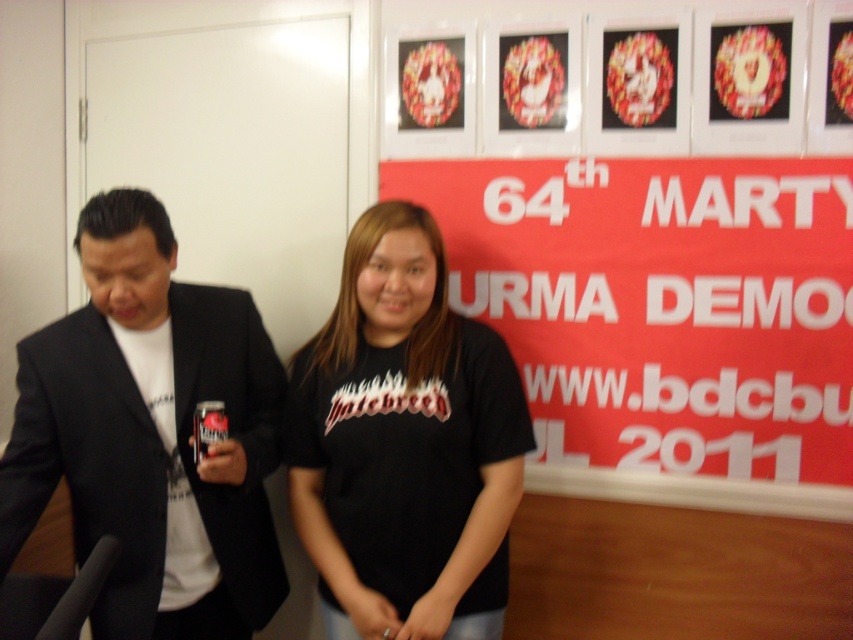
Can you confirm if black matte suit at left is wider than black matte t-shirt at center?

Incorrect, black matte suit at left's width does not surpass black matte t-shirt at center's.

I want to click on black matte suit at left, so click(151, 435).

The height and width of the screenshot is (640, 853). Describe the element at coordinates (151, 435) in the screenshot. I see `black matte suit at left` at that location.

Locate an element on the screen. black matte suit at left is located at coordinates (151, 435).

The width and height of the screenshot is (853, 640). Describe the element at coordinates (660, 304) in the screenshot. I see `red matte poster at center` at that location.

Is red matte poster at center bigger than black matte suit at left?

Indeed, red matte poster at center has a larger size compared to black matte suit at left.

Describe the element at coordinates (660, 304) in the screenshot. I see `red matte poster at center` at that location.

I want to click on red matte poster at center, so click(660, 304).

Locate an element on the screen. The image size is (853, 640). red matte poster at center is located at coordinates (660, 304).

Consider the image. Is red matte poster at center bigger than black matte t-shirt at center?

Indeed, red matte poster at center has a larger size compared to black matte t-shirt at center.

Who is more forward, (796, 365) or (500, 525)?

Point (500, 525) is more forward.

Locate an element on the screen. Image resolution: width=853 pixels, height=640 pixels. red matte poster at center is located at coordinates (660, 304).